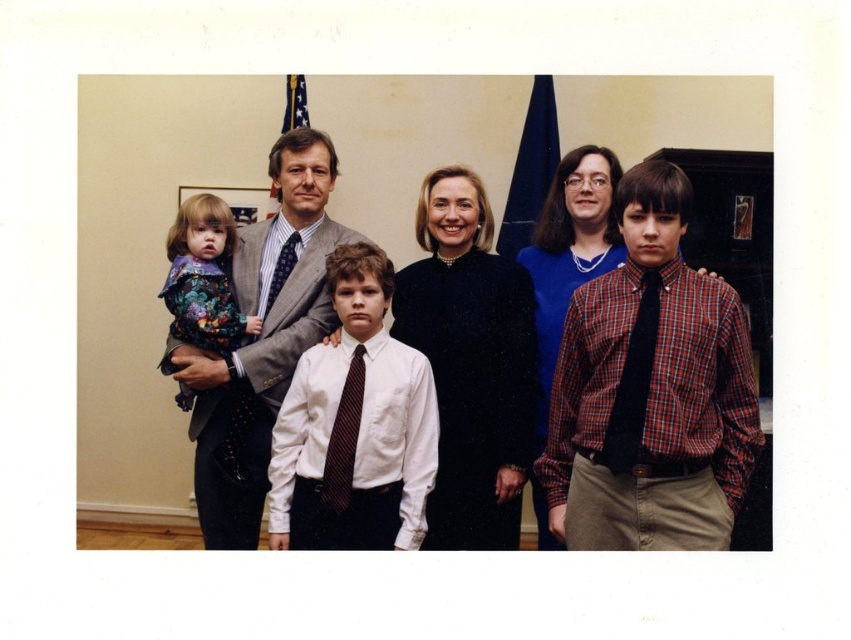
You are standing in front of the group photo and want to know which of the two points, point (307, 266) or point (271, 298), is closer to you. Can you determine this based on their positions?

Point (307, 266) is closer to you because it is further to the viewer than point (271, 298).